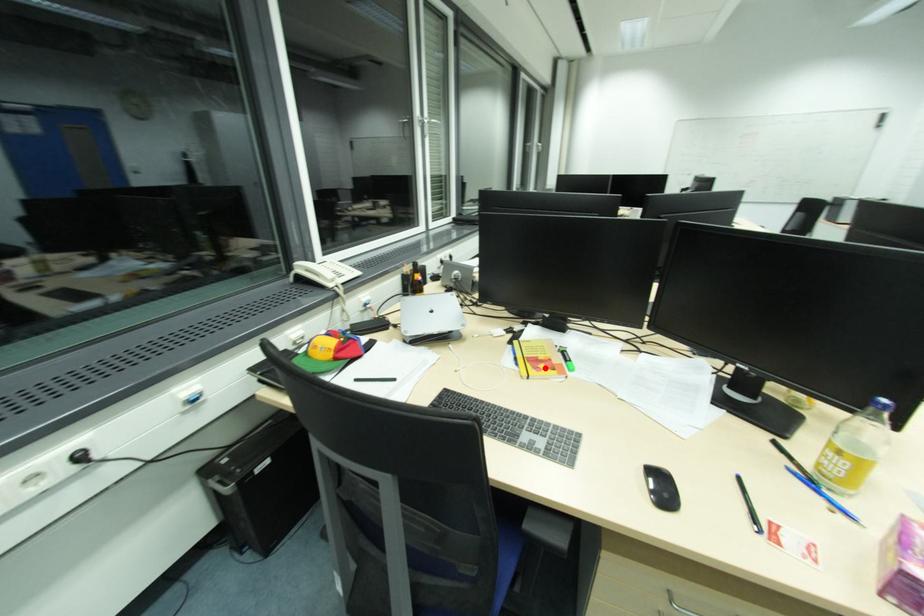
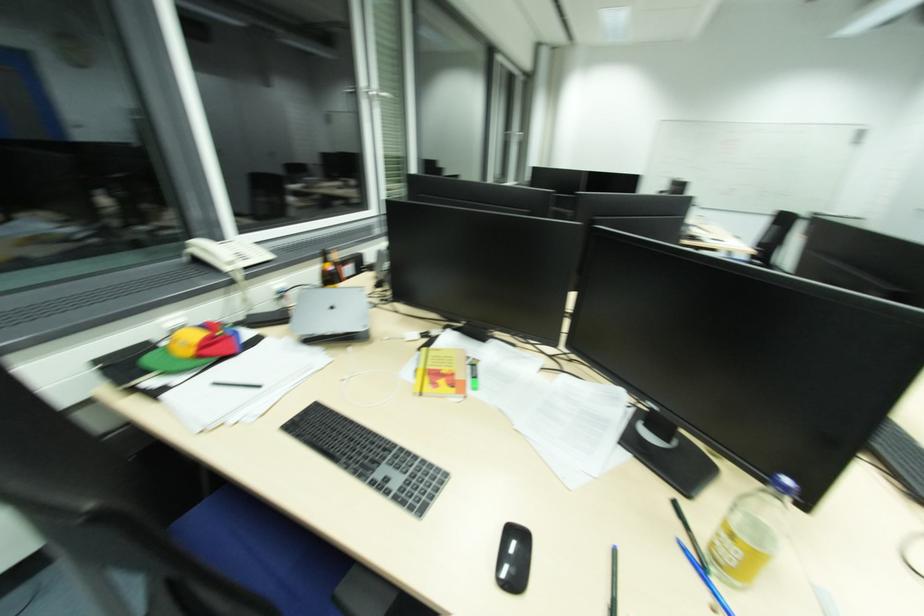
The point at the highlighted location is marked in the first image. Where is the corresponding point in the second image?

(444, 383)